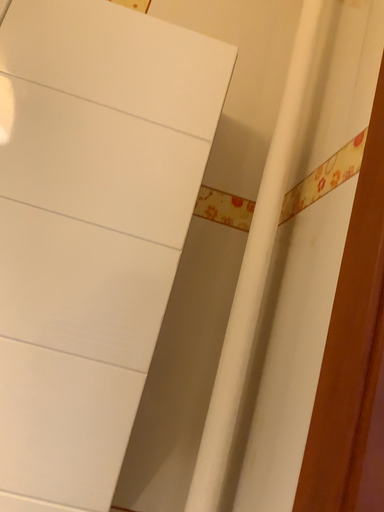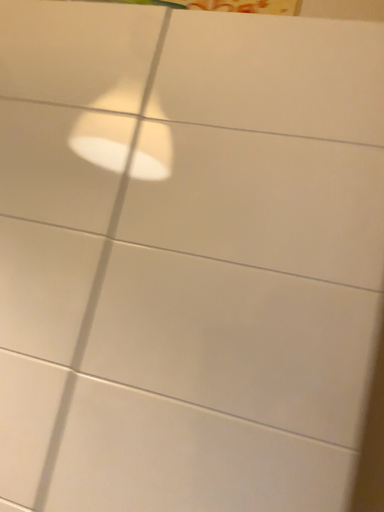
Question: How did the camera likely rotate when shooting the video?

Choices:
 (A) rotated right
 (B) rotated left

Answer: (B)